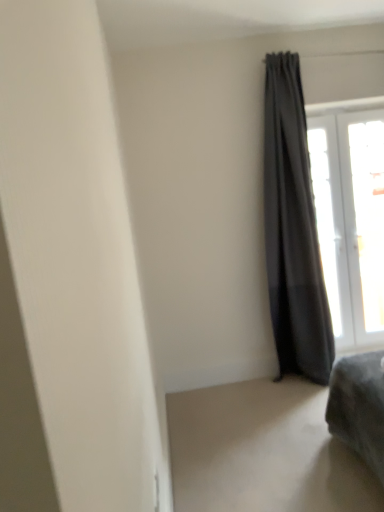
Where is `empty space that is ontop of transparent glass window at upper right, the first window when ordered from left to right (from a real-world perspective)`? empty space that is ontop of transparent glass window at upper right, the first window when ordered from left to right (from a real-world perspective) is located at coordinates (347, 106).